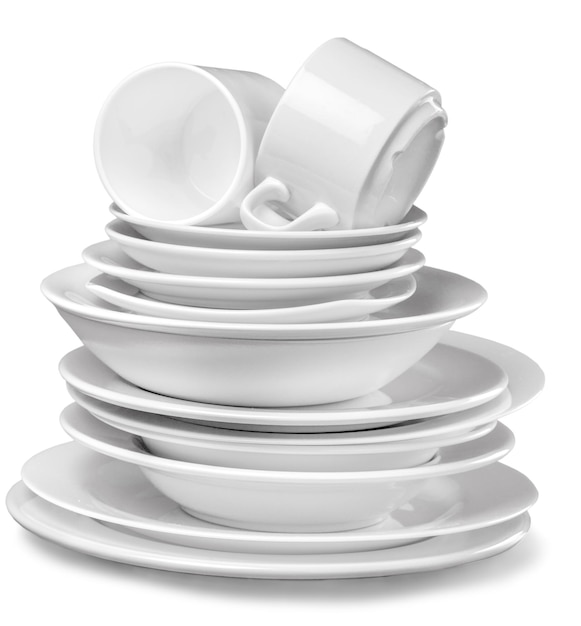
Find the location of `plate`. plate is located at coordinates (87, 536), (101, 510), (146, 422), (132, 401).